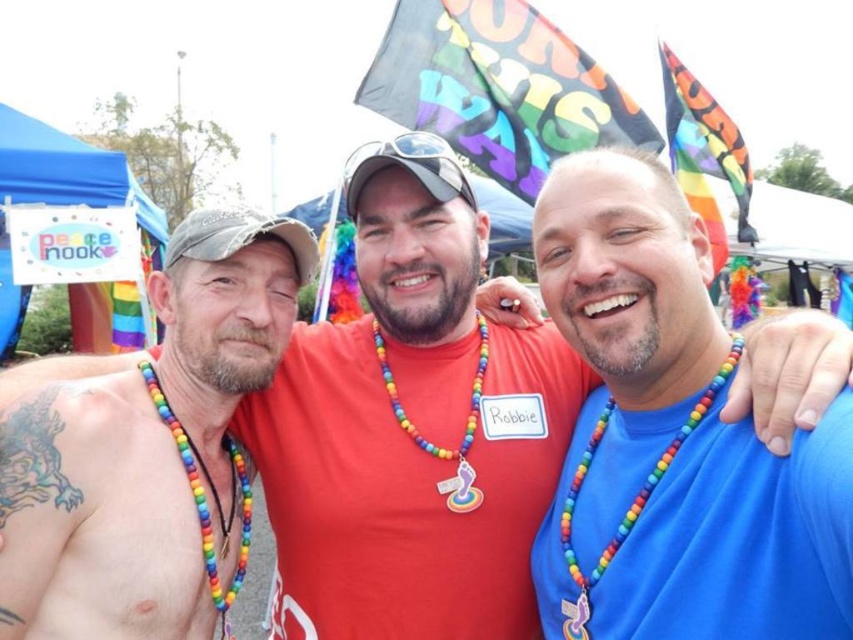
You are a photographer at the event and want to ensure both rainbow beaded necklaces are visible in your photo. Since the rainbow beaded necklace at left and rainbow beaded necklace at center are different in size, which one might require more focus to capture its details?

The rainbow beaded necklace at left has a larger size compared to rainbow beaded necklace at center, so it might require more focus to capture its details.

You are standing in front of the group at the pride parade. You notice two points marked on the ground in front of them. One is at coordinates point [634,444] and the other at point [91,422]. Which point is closer to you?

Point [634,444] is further to the viewer than point [91,422], so the point closer to you is point [91,422].

You are at a pride parade and want to take a photo with the blue skin at upper left and rainbow beads necklace at center. Since you can only focus on one subject, which one should you aim for to ensure the other is still in the frame?

You should aim for the rainbow beads necklace at center because the blue skin at upper left is to the left of it, so keeping the necklace centered will include the blue skin in the frame as well.